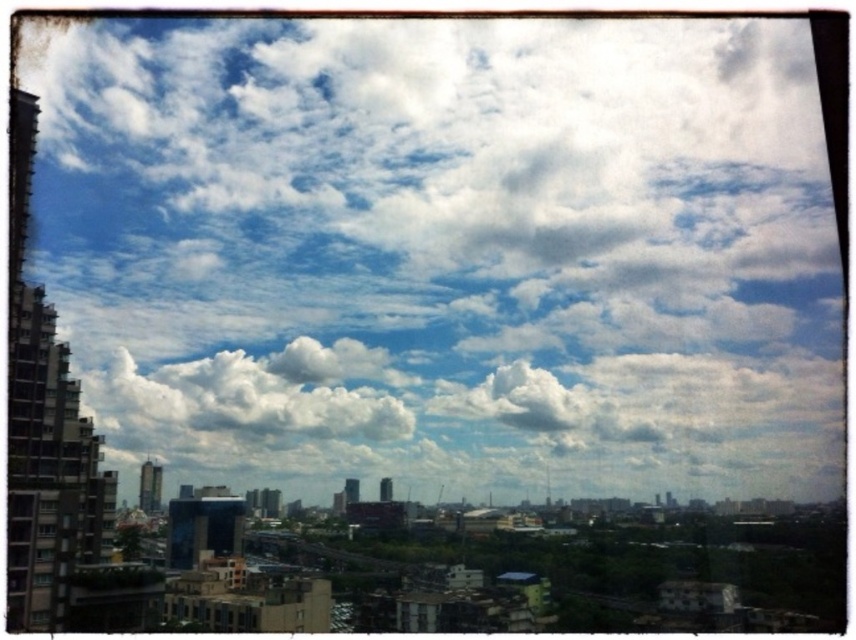
Question: Is white fluffy cloud at upper center closer to the viewer compared to white fluffy cloud at center?

Choices:
 (A) yes
 (B) no

Answer: (A)

Question: Is white fluffy cloud at upper center to the right of white fluffy cloud at center from the viewer's perspective?

Choices:
 (A) yes
 (B) no

Answer: (A)

Question: Observing the image, what is the correct spatial positioning of white fluffy cloud at upper center in reference to white fluffy cloud at center?

Choices:
 (A) below
 (B) above

Answer: (B)

Question: Which point appears closest to the camera in this image?

Choices:
 (A) (651, 68)
 (B) (342, 387)

Answer: (B)